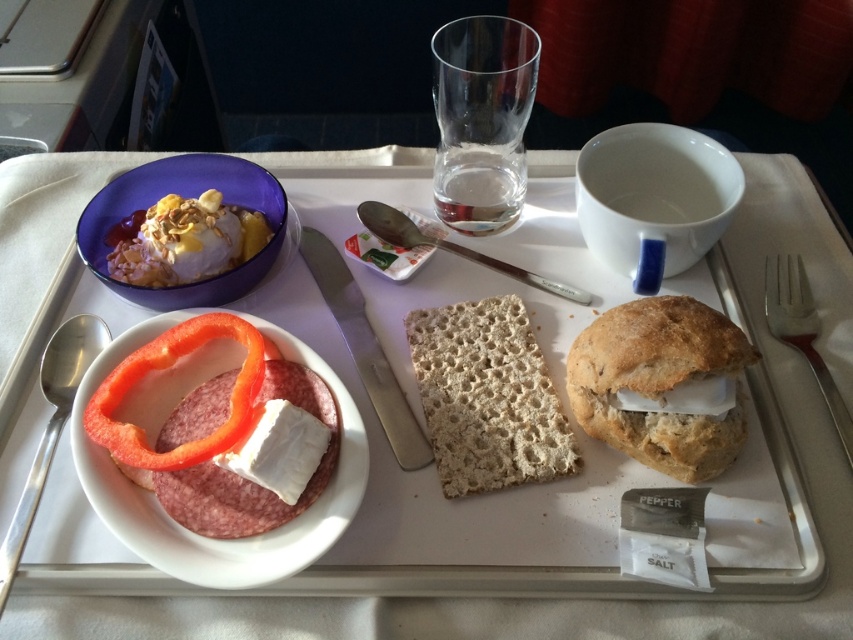
You are a flight attendant checking the meal tray. The airline requires that the white crumbly bread at center must not extend beyond the edges of the breadcrustysandwich at right. Is this requirement being met?

The white crumbly bread at center has a larger width than the breadcrustysandwich at right, so it does extend beyond the edges of the breadcrustysandwich at right. The requirement is not being met.